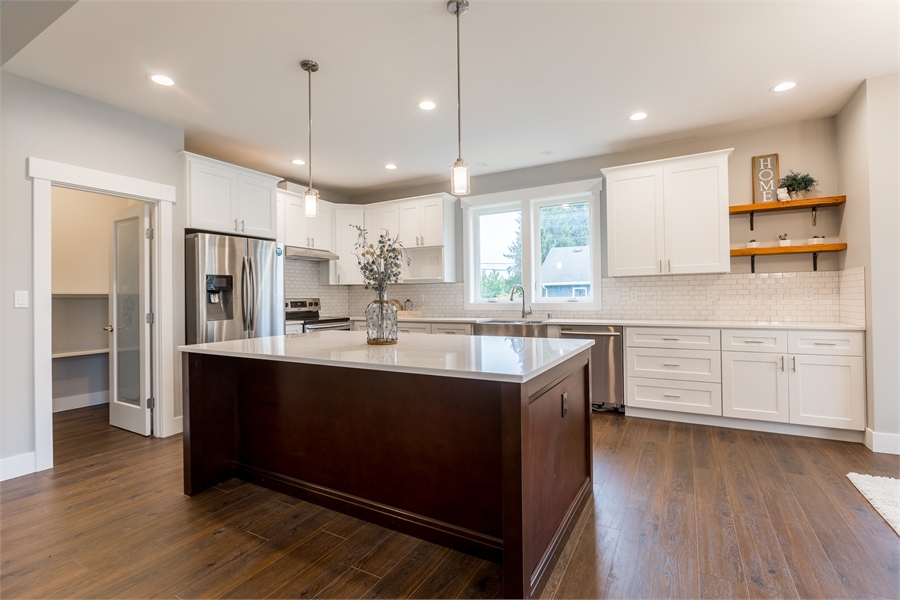
Locate an element on the screen. The image size is (900, 600). shelves is located at coordinates (82, 294), (82, 351), (801, 200), (795, 248).